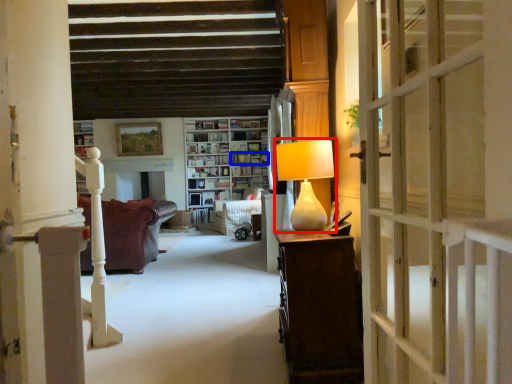
Question: Which object is further to the camera taking this photo, table lamp (highlighted by a red box) or shelf (highlighted by a blue box)?

Choices:
 (A) table lamp
 (B) shelf

Answer: (B)